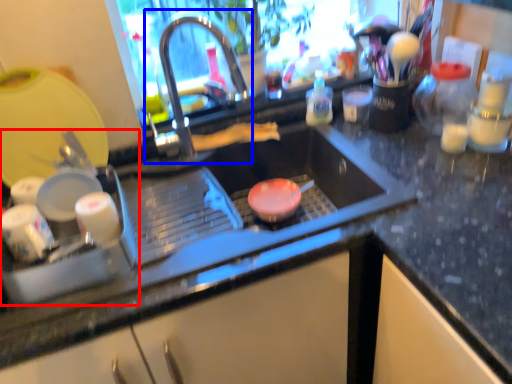
Question: Among these objects, which one is nearest to the camera, appliance (highlighted by a red box) or tap (highlighted by a blue box)?

Choices:
 (A) appliance
 (B) tap

Answer: (A)